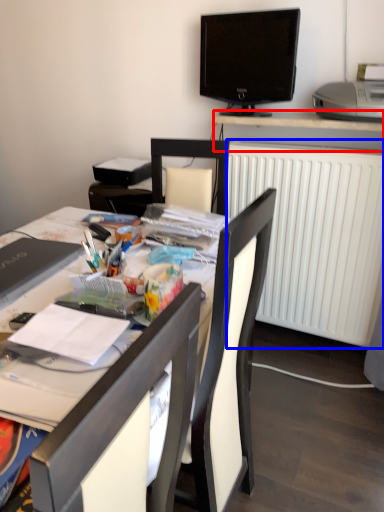
Question: Among these objects, which one is nearest to the camera, desk (highlighted by a red box) or radiator (highlighted by a blue box)?

Choices:
 (A) desk
 (B) radiator

Answer: (B)